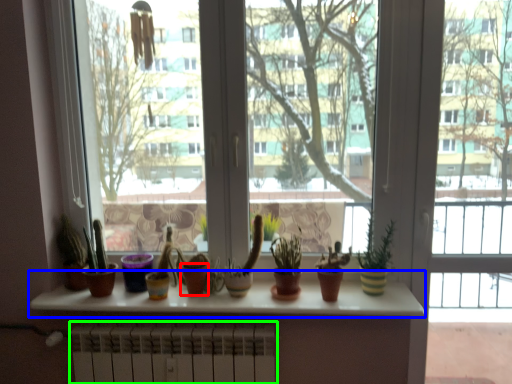
Question: Which object is the farthest from flowerpot (highlighted by a red box)? Choose among these: window sill (highlighted by a blue box) or radiator (highlighted by a green box).

Choices:
 (A) window sill
 (B) radiator

Answer: (A)